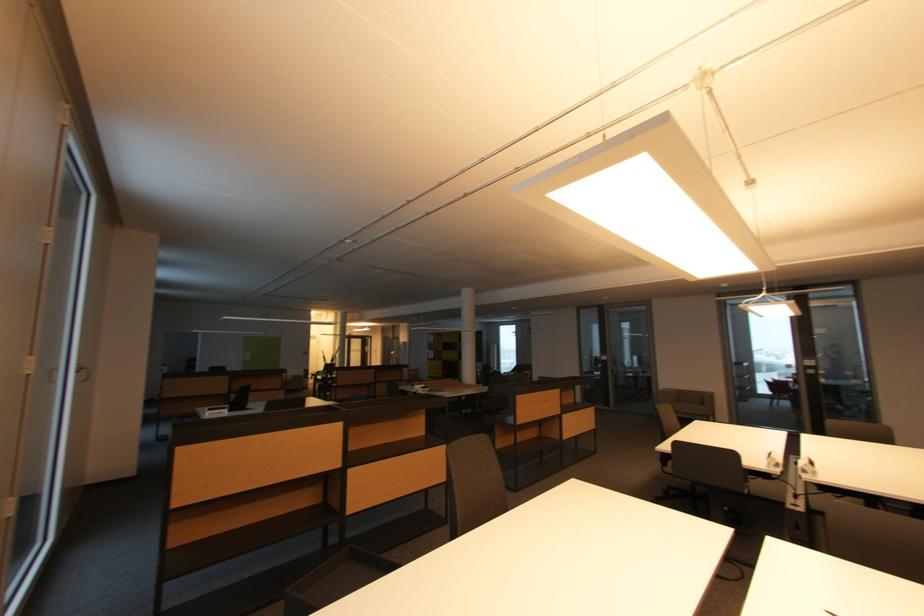
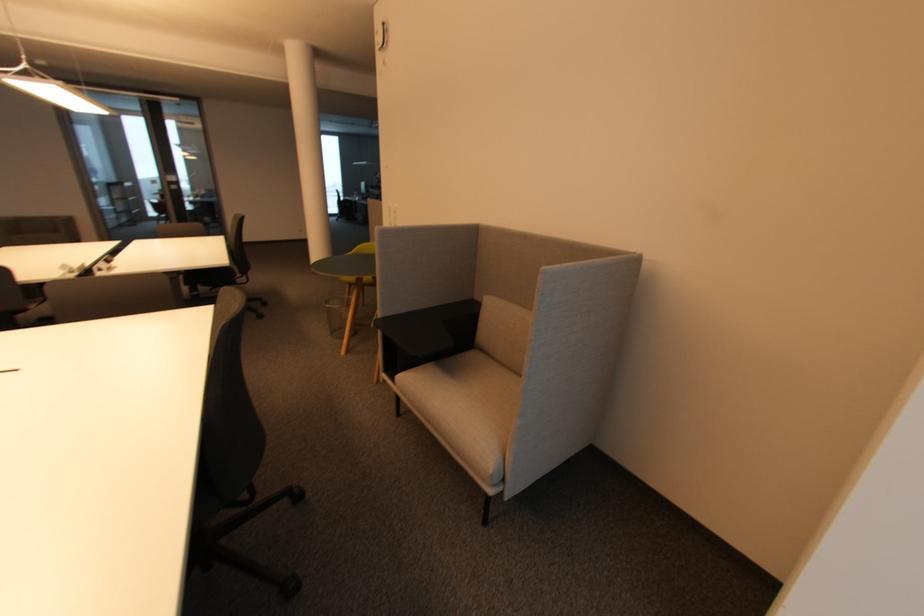
How did the camera likely rotate?

The camera's rotation is toward right-down.